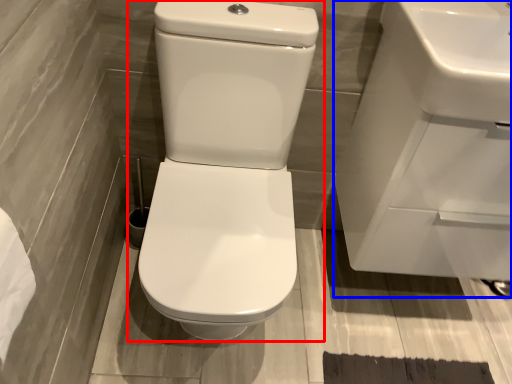
Question: Which object appears farthest to the camera in this image, toilet (highlighted by a red box) or sink (highlighted by a blue box)?

Choices:
 (A) toilet
 (B) sink

Answer: (B)